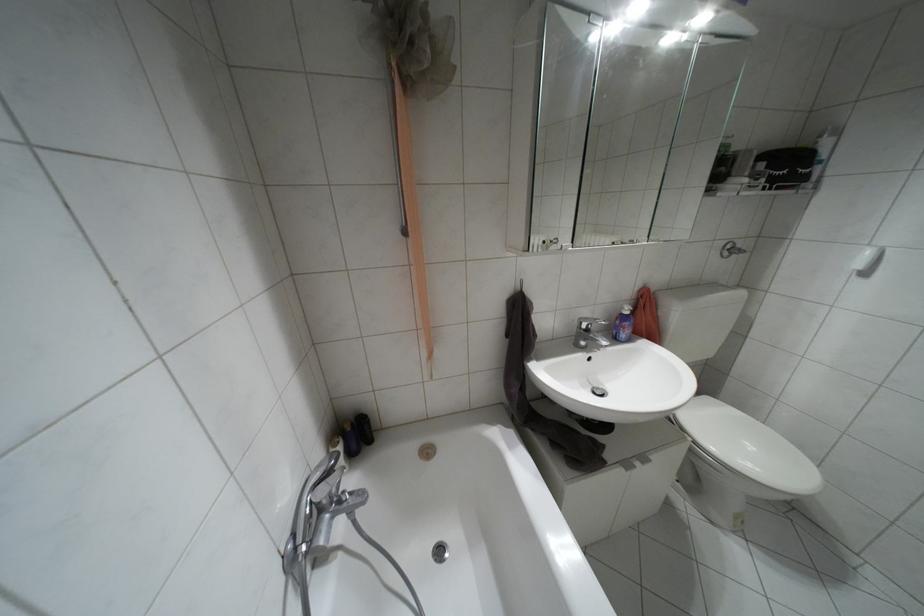
What do you see at coordinates (365, 428) in the screenshot?
I see `the black bottle` at bounding box center [365, 428].